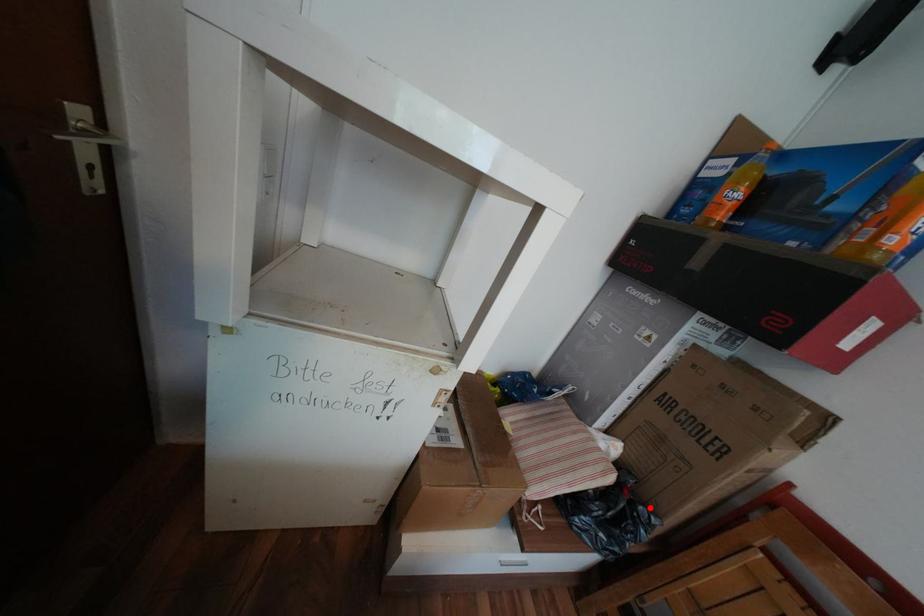
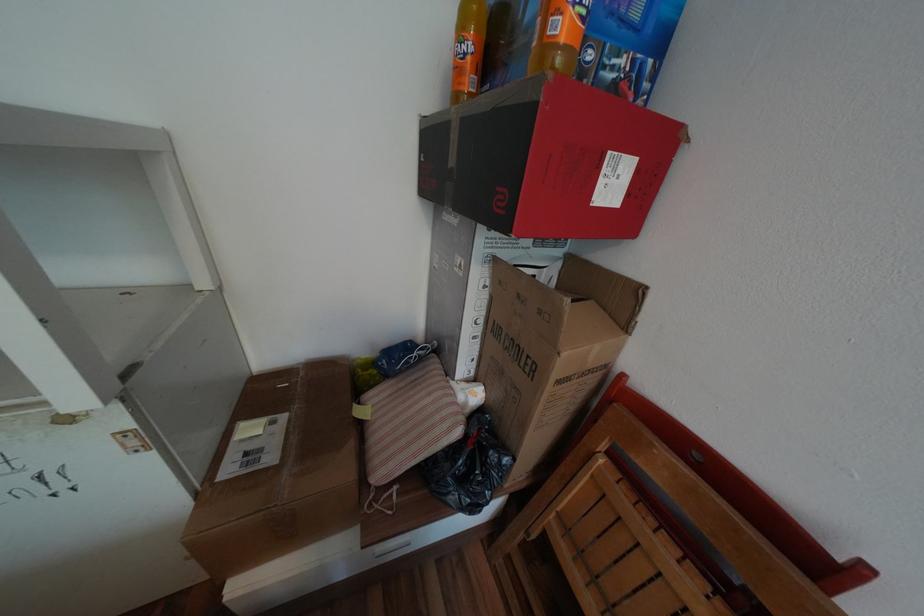
Find the pixel in the second image that matches the highlighted location in the first image.

(500, 453)